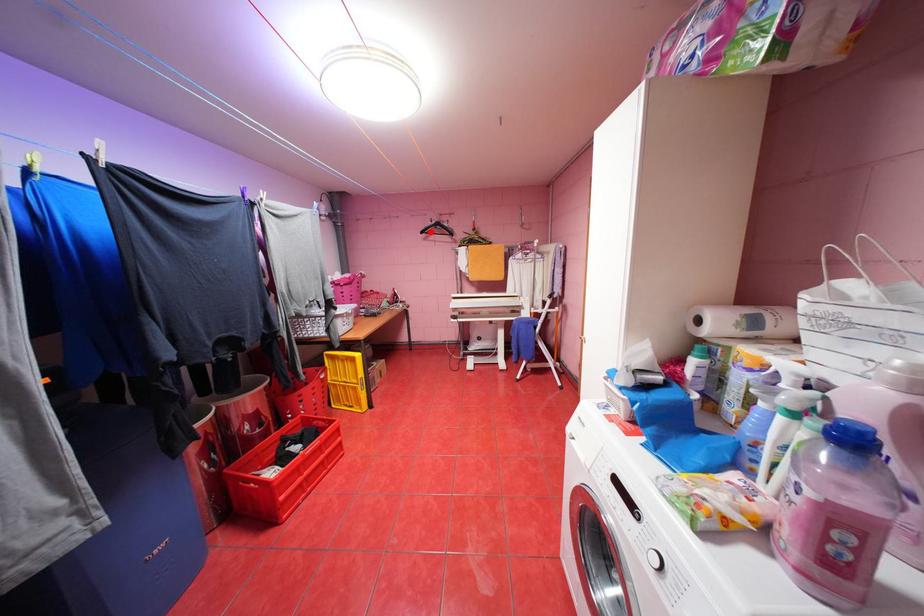
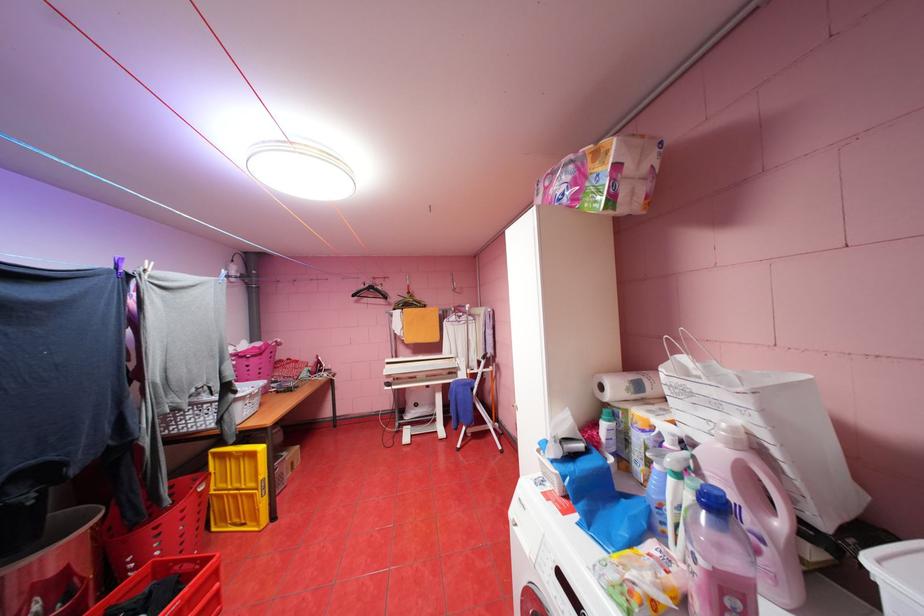
In the second image, find the point that corresponds to the highlighted location in the first image.

(361, 294)